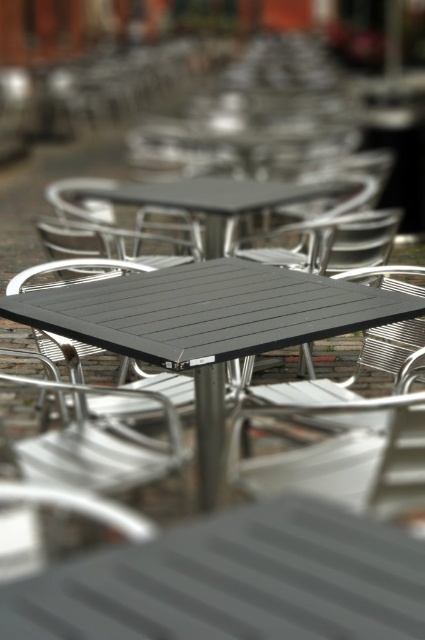
Is black plastic table at center below matte black table at center?

Yes, black plastic table at center is below matte black table at center.

Can you confirm if black plastic table at center is positioned above matte black table at center?

Actually, black plastic table at center is below matte black table at center.

Who is more forward, (209, 317) or (314, 195)?

Point (209, 317) is more forward.

Identify the location of black plastic table at center. The height and width of the screenshot is (640, 425). (207, 326).